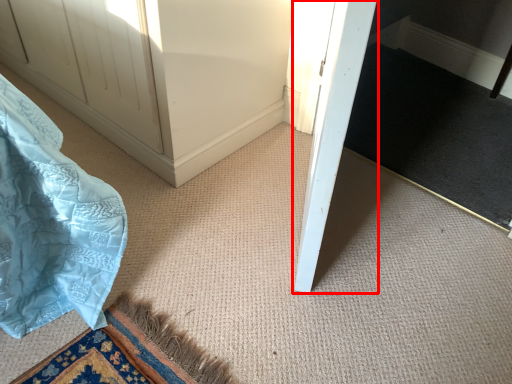
Question: In this image, where is door (annotated by the red box) located relative to doormat?

Choices:
 (A) left
 (B) right

Answer: (A)